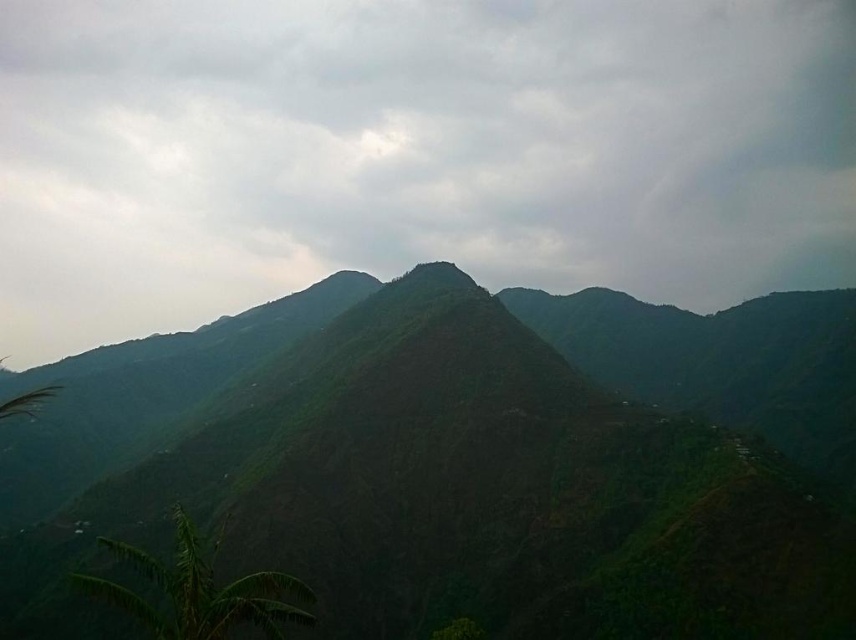
You are standing at the base of the mountain looking at the scene. There is a point marked at coordinates point (413, 152). What is located at that point?

The point (413, 152) corresponds to the green matte cloud at upper center.